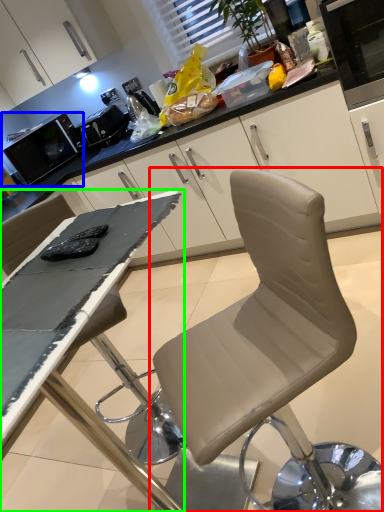
Question: Estimate the real-world distances between objects in this image. Which object is farther from chair (highlighted by a red box), appliance (highlighted by a blue box) or table (highlighted by a green box)?

Choices:
 (A) appliance
 (B) table

Answer: (A)